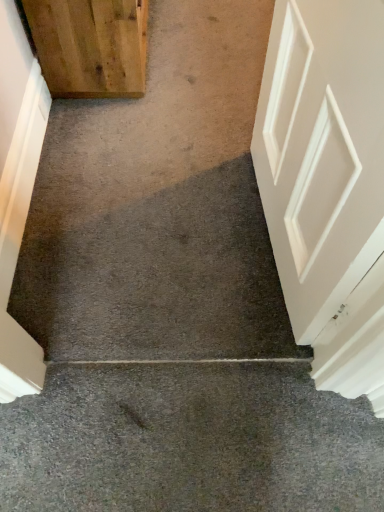
What do you see at coordinates (18, 192) in the screenshot? I see `white matte door at left, positioned as the first door in bottom-to-top order` at bounding box center [18, 192].

Consider the image. What is the approximate height of white matte door at left, the second door in the top-to-bottom sequence?

7.38 inches.

At what (x,y) coordinates should I click in order to perform the action: click on gray carpet at center. Please return your answer as a coordinate pair (x, y). Looking at the image, I should click on (x=189, y=441).

Between wooden door at upper left, which appears as the first door when viewed from the top, and white matte door at left, the second door in the top-to-bottom sequence, which one appears on the left side from the viewer's perspective?

white matte door at left, the second door in the top-to-bottom sequence, is more to the left.

Is white matte door at left, the second door in the top-to-bottom sequence, at the back of wooden door at upper left, which appears as the first door when viewed from the top?

No, wooden door at upper left, which appears as the first door when viewed from the top, is not facing away from white matte door at left, the second door in the top-to-bottom sequence.

From their relative heights in the image, would you say wooden door at upper left, the second door positioned from the bottom, is taller or shorter than white matte door at left, the second door in the top-to-bottom sequence?

Clearly, wooden door at upper left, the second door positioned from the bottom, is taller compared to white matte door at left, the second door in the top-to-bottom sequence.

Is wooden door at upper left, the second door positioned from the bottom, closer to the viewer compared to white matte door at left, the second door in the top-to-bottom sequence?

No.

Considering the positions of objects gray carpet at center and wooden door at upper left, which appears as the first door when viewed from the top, in the image provided, who is more to the left, gray carpet at center or wooden door at upper left, which appears as the first door when viewed from the top,?

Positioned to the left is wooden door at upper left, which appears as the first door when viewed from the top.

Considering the sizes of gray carpet at center and wooden door at upper left, the second door positioned from the bottom, in the image, is gray carpet at center taller or shorter than wooden door at upper left, the second door positioned from the bottom,?

Clearly, gray carpet at center is shorter compared to wooden door at upper left, the second door positioned from the bottom.

Is gray carpet at center inside or outside of wooden door at upper left, the second door positioned from the bottom?

gray carpet at center exists outside the volume of wooden door at upper left, the second door positioned from the bottom.

Considering the sizes of objects gray carpet at center and wooden door at upper left, the second door positioned from the bottom, in the image provided, who is wider, gray carpet at center or wooden door at upper left, the second door positioned from the bottom,?

Wider between the two is wooden door at upper left, the second door positioned from the bottom.

Is the position of wooden door at upper left, the second door positioned from the bottom, more distant than that of gray carpet at center?

That is True.

From the image's perspective, between wooden door at upper left, which appears as the first door when viewed from the top, and gray carpet at center, which one is located above?

wooden door at upper left, which appears as the first door when viewed from the top, appears higher in the image.

Which of these two, wooden door at upper left, which appears as the first door when viewed from the top, or gray carpet at center, is smaller?

gray carpet at center.

I want to click on concrete to the right of wooden door at upper left, the second door positioned from the bottom, so click(189, 441).

From a real-world perspective, is white matte door at left, the second door in the top-to-bottom sequence, on wooden door at upper left, the second door positioned from the bottom?

No, from a real-world perspective, white matte door at left, the second door in the top-to-bottom sequence, is not on top of wooden door at upper left, the second door positioned from the bottom.

Consider the image. Is white matte door at left, the second door in the top-to-bottom sequence, shorter than wooden door at upper left, which appears as the first door when viewed from the top?

Yes, white matte door at left, the second door in the top-to-bottom sequence, is shorter than wooden door at upper left, which appears as the first door when viewed from the top.

Where is `door that is on the right side of white matte door at left, the second door in the top-to-bottom sequence`? The image size is (384, 512). door that is on the right side of white matte door at left, the second door in the top-to-bottom sequence is located at coordinates (90, 46).

Is point (7, 45) closer or farther from the camera than point (101, 35)?

Point (7, 45) is closer to the camera than point (101, 35).

Considering the positions of objects white matte door at left, the second door in the top-to-bottom sequence, and gray carpet at center in the image provided, who is more to the left, white matte door at left, the second door in the top-to-bottom sequence, or gray carpet at center?

From the viewer's perspective, white matte door at left, the second door in the top-to-bottom sequence, appears more on the left side.

From a real-world perspective, is white matte door at left, positioned as the first door in bottom-to-top order, under gray carpet at center?

No, from a real-world perspective, white matte door at left, positioned as the first door in bottom-to-top order, is not below gray carpet at center.

Could you tell me if white matte door at left, positioned as the first door in bottom-to-top order, is facing gray carpet at center?

No, white matte door at left, positioned as the first door in bottom-to-top order, is not aimed at gray carpet at center.

Considering the positions of objects white matte door at left, positioned as the first door in bottom-to-top order, and gray carpet at center in the image provided, who is in front, white matte door at left, positioned as the first door in bottom-to-top order, or gray carpet at center?

gray carpet at center is more forward.

From the image's perspective, relative to white matte door at left, positioned as the first door in bottom-to-top order, is gray carpet at center above or below?

gray carpet at center is situated lower than white matte door at left, positioned as the first door in bottom-to-top order, in the image.

Can you tell me how much gray carpet at center and white matte door at left, positioned as the first door in bottom-to-top order, differ in facing direction?

They differ by 88.2 degrees in their facing directions.

Could you tell me if gray carpet at center is turned towards white matte door at left, the second door in the top-to-bottom sequence?

No.

The image size is (384, 512). I want to click on door that is above the white matte door at left, the second door in the top-to-bottom sequence (from the image's perspective), so click(90, 46).

Locate an element on the screen. The image size is (384, 512). concrete on the right side of wooden door at upper left, which appears as the first door when viewed from the top is located at coordinates (189, 441).

Which object lies further to the anchor point white matte door at left, the second door in the top-to-bottom sequence, gray carpet at center or wooden door at upper left, the second door positioned from the bottom?

gray carpet at center is positioned further to the anchor white matte door at left, the second door in the top-to-bottom sequence.

From the image, which object appears to be farther from gray carpet at center, wooden door at upper left, which appears as the first door when viewed from the top, or white matte door at left, positioned as the first door in bottom-to-top order?

wooden door at upper left, which appears as the first door when viewed from the top, lies further to gray carpet at center than the other object.

Considering their positions, is white matte door at left, the second door in the top-to-bottom sequence, positioned further to gray carpet at center than wooden door at upper left, the second door positioned from the bottom?

wooden door at upper left, the second door positioned from the bottom, lies further to gray carpet at center than the other object.

When comparing their distances from white matte door at left, positioned as the first door in bottom-to-top order, does wooden door at upper left, the second door positioned from the bottom, or gray carpet at center seem closer?

wooden door at upper left, the second door positioned from the bottom, is closer to white matte door at left, positioned as the first door in bottom-to-top order.

Estimate the real-world distances between objects in this image. Which object is further from wooden door at upper left, which appears as the first door when viewed from the top, white matte door at left, positioned as the first door in bottom-to-top order, or gray carpet at center?

Based on the image, gray carpet at center appears to be further to wooden door at upper left, which appears as the first door when viewed from the top.

Which object lies further to the anchor point wooden door at upper left, which appears as the first door when viewed from the top, gray carpet at center or white matte door at left, positioned as the first door in bottom-to-top order?

Among the two, gray carpet at center is located further to wooden door at upper left, which appears as the first door when viewed from the top.

Identify the location of door between wooden door at upper left, the second door positioned from the bottom, and gray carpet at center vertically. (18, 192).